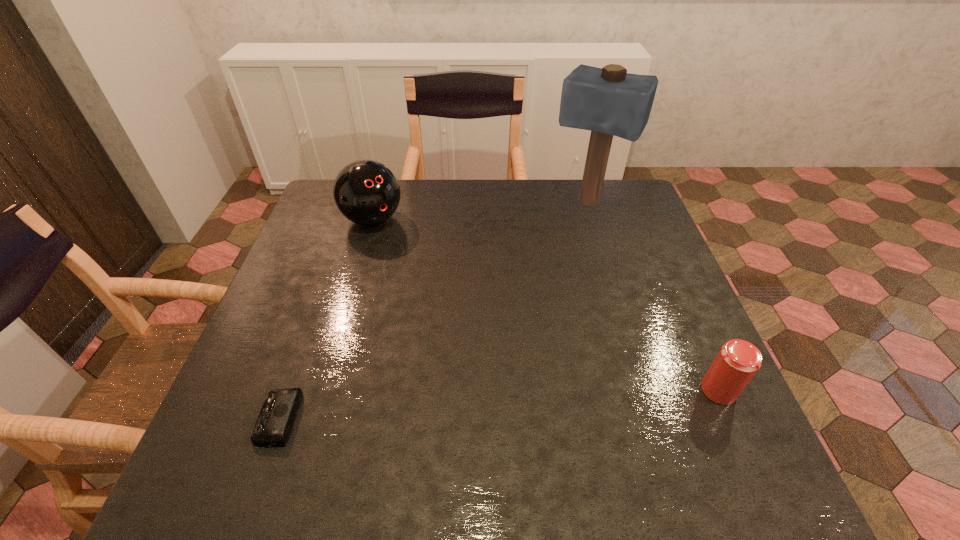
The width and height of the screenshot is (960, 540). I want to click on alarm clock, so click(275, 421).

Locate an element on the screen. the second shortest object is located at coordinates (738, 361).

You are a GUI agent. You are given a task and a screenshot of the screen. Output one action in this format:
    pyautogui.click(x=<x>, y=<y>)
    Task: Click on the second tallest object
    The width and height of the screenshot is (960, 540).
    Given the screenshot: What is the action you would take?
    pyautogui.click(x=366, y=192)

Find the location of a particular element. This screenshot has height=540, width=960. mallet is located at coordinates (608, 101).

Find the location of a particular element. This screenshot has width=960, height=540. free spot located 0.080m on the display of the alarm clock is located at coordinates (220, 418).

The image size is (960, 540). In order to click on blank space located 0.060m on the back of the beer can in this screenshot , I will do `click(702, 353)`.

Locate an element on the screen. The width and height of the screenshot is (960, 540). vacant space located on the surface of the second tallest object near the finger holes is located at coordinates (397, 243).

At what (x,y) coordinates should I click in order to perform the action: click on vacant region located 0.210m on the surface of the second tallest object near the finger holes. Please return your answer as a coordinate pair (x, y). Image resolution: width=960 pixels, height=540 pixels. Looking at the image, I should click on click(429, 273).

Image resolution: width=960 pixels, height=540 pixels. I want to click on vacant space located on the surface of the second tallest object near the finger holes, so (461, 304).

You are a GUI agent. You are given a task and a screenshot of the screen. Output one action in this format:
    pyautogui.click(x=<x>, y=<y>)
    Task: Click on the free space located on the striking surface of the tallest object
    This screenshot has height=540, width=960.
    Given the screenshot: What is the action you would take?
    pyautogui.click(x=546, y=266)